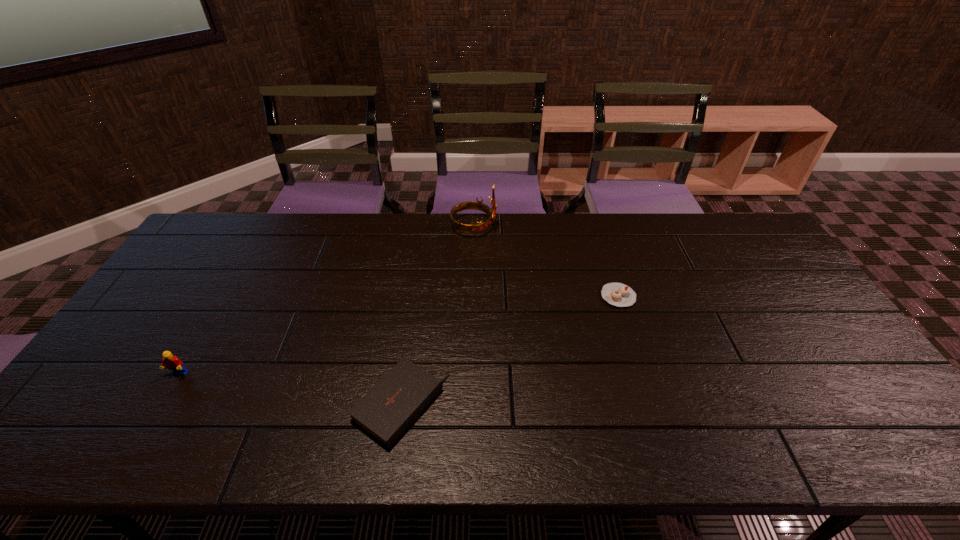
Where is `free location that satisfies the following two spatial constraints: 1. on the front-facing side of the farthest object; 2. on the right side of the second farthest object`? The height and width of the screenshot is (540, 960). free location that satisfies the following two spatial constraints: 1. on the front-facing side of the farthest object; 2. on the right side of the second farthest object is located at coordinates (472, 296).